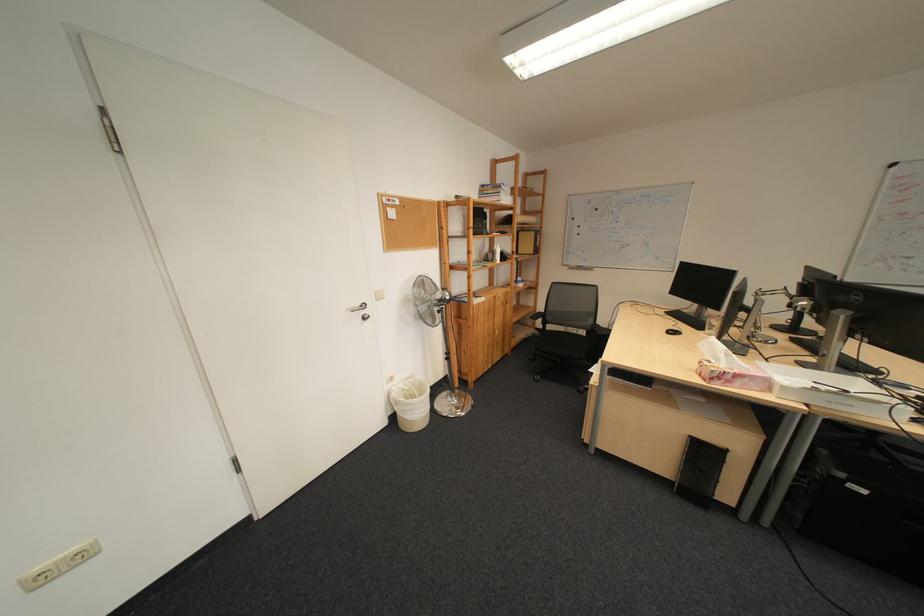
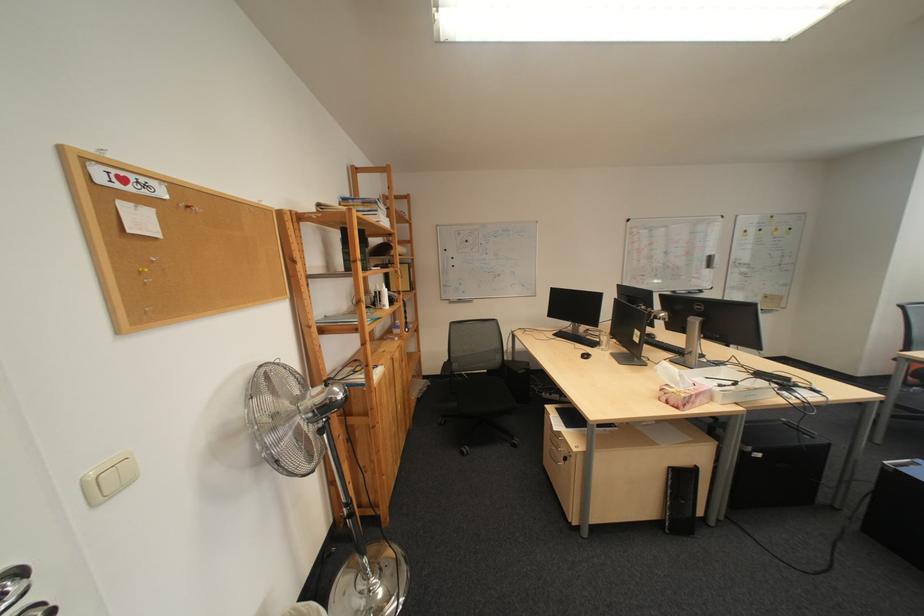
Where in the second image is the point corresponding to (x=391, y=296) from the first image?

(107, 488)